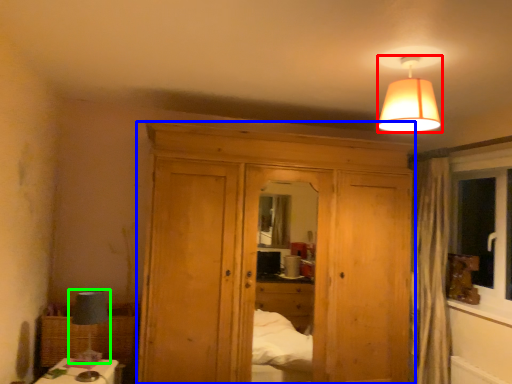
Question: Which object is positioned closest to lamp (highlighted by a red box)? Select from dresser (highlighted by a blue box) and table lamp (highlighted by a green box).

Choices:
 (A) dresser
 (B) table lamp

Answer: (A)